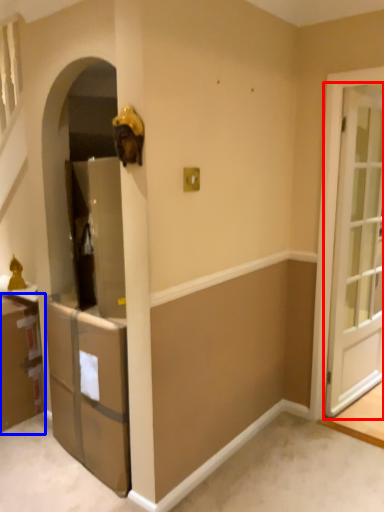
Question: Which of the following is the closest to the observer, door (highlighted by a red box) or cabinetry (highlighted by a blue box)?

Choices:
 (A) door
 (B) cabinetry

Answer: (A)